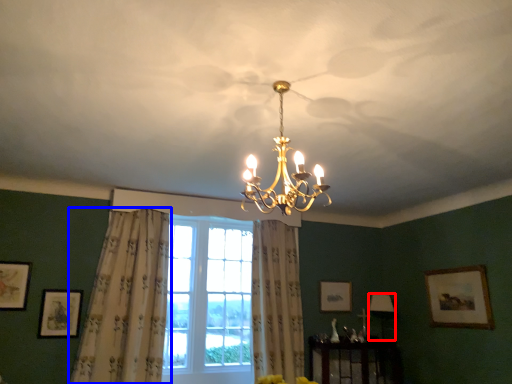
Question: Which object is further to the camera taking this photo, lamp (highlighted by a red box) or curtain (highlighted by a blue box)?

Choices:
 (A) lamp
 (B) curtain

Answer: (A)